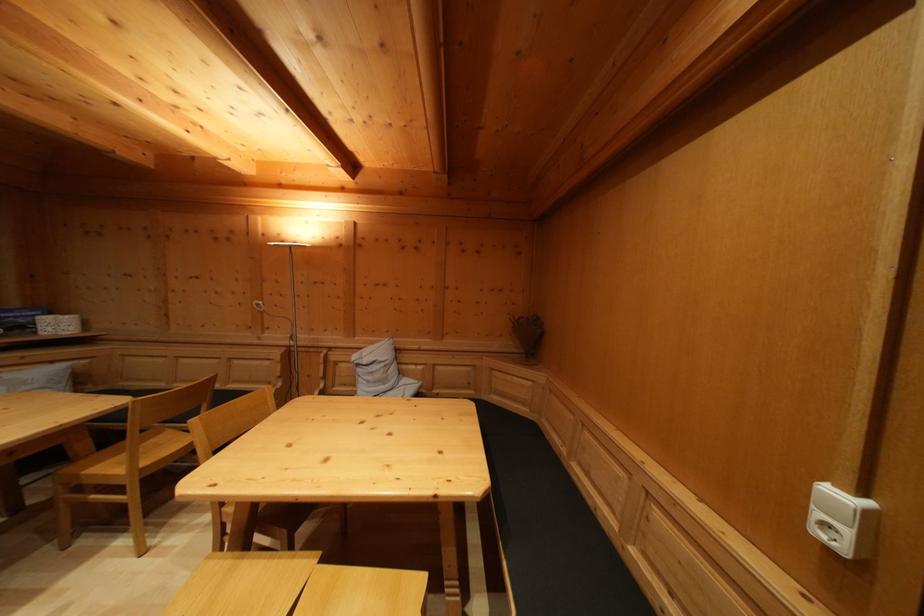
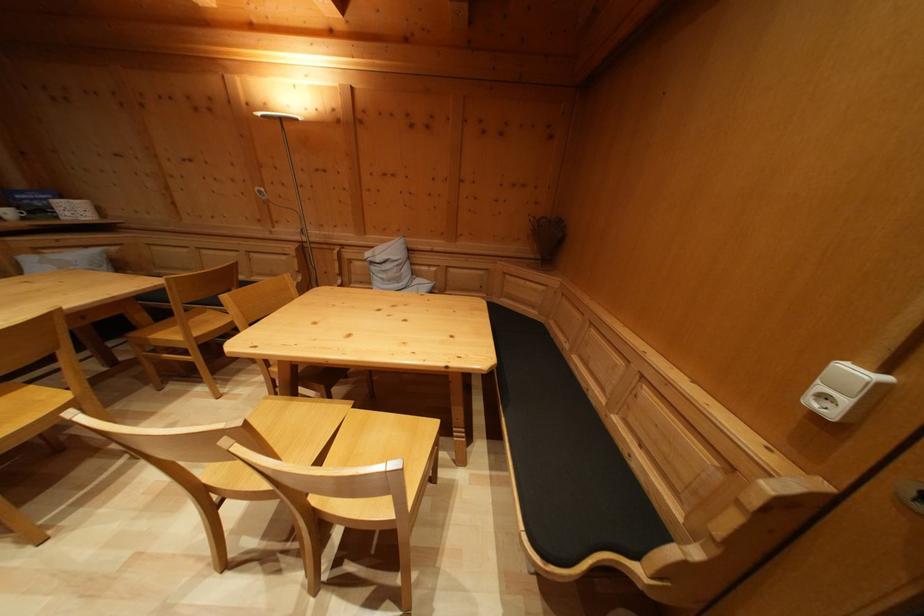
Where in the second image is the point corresponding to (508,564) from the first image?

(507, 422)